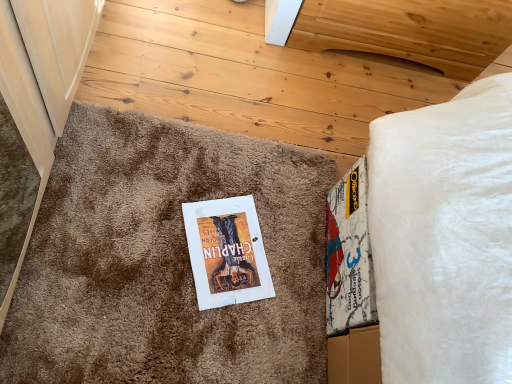
Where is `vacant area that is in front of white paper book at center`? The height and width of the screenshot is (384, 512). vacant area that is in front of white paper book at center is located at coordinates (177, 320).